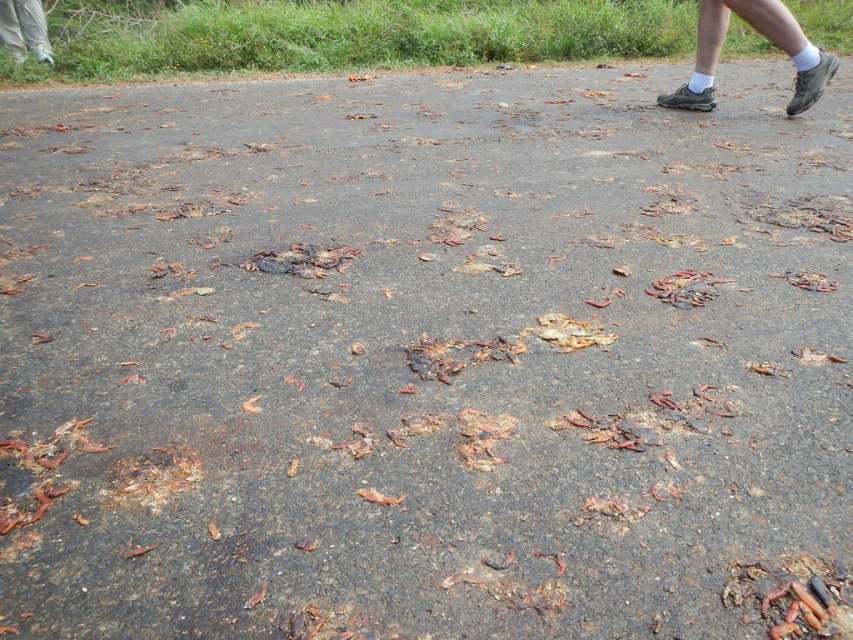
You are a pedestrian standing on the paved surface covered with organic debris. You notice gray suede shoes at upper right and white striped pants at upper left. Which object is positioned to the right side of the other?

The gray suede shoes at upper right is positioned to the right of white striped pants at upper left.

You are a pedestrian standing on the brown asphalt road at upper center and want to reach the gray suede shoes at upper right. Which direction should you walk to get closer to the shoes?

You should walk downward because the gray suede shoes at upper right are located below the brown asphalt road at upper center.

You are a pedestrian walking on the paved surface covered with organic debris. You notice the gray suede shoes at upper right and the white striped pants at upper left. Which object is bigger in size?

The gray suede shoes at upper right is larger in size compared to the white striped pants at upper left according to the description.